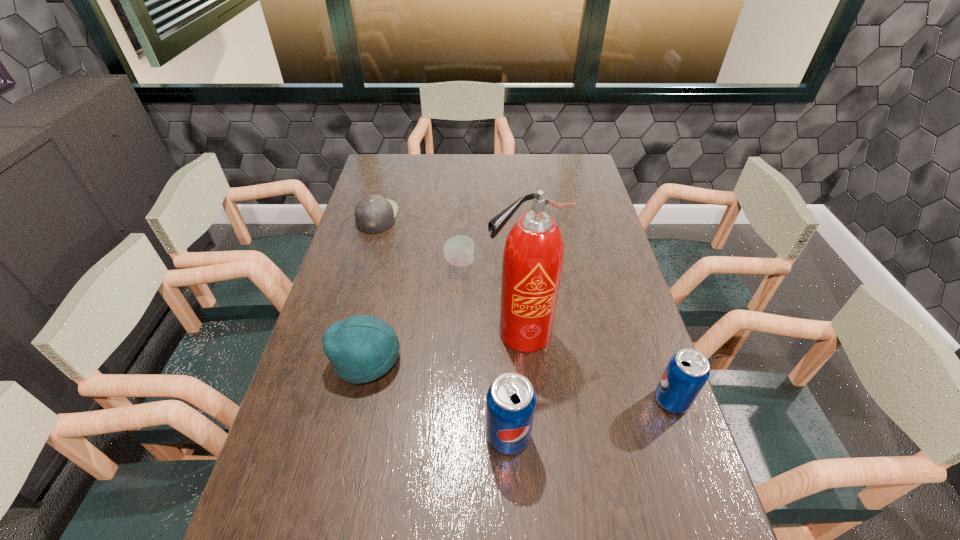
Where is `the taller pop soda`? Image resolution: width=960 pixels, height=540 pixels. the taller pop soda is located at coordinates (511, 399).

You are a GUI agent. You are given a task and a screenshot of the screen. Output one action in this format:
    pyautogui.click(x=<x>, y=<y>)
    Task: Click on the second tallest object
    
    Given the screenshot: What is the action you would take?
    pyautogui.click(x=511, y=399)

Locate an element on the screen. the right pop soda is located at coordinates (688, 370).

This screenshot has width=960, height=540. In order to click on the rightmost object in this screenshot , I will do `click(688, 370)`.

Find the location of a particular element. The height and width of the screenshot is (540, 960). the farthest object is located at coordinates (373, 214).

This screenshot has width=960, height=540. Find the location of `the third object from left to right`. the third object from left to right is located at coordinates (459, 250).

The image size is (960, 540). What are the coordinates of `the second farthest object` in the screenshot? It's located at (459, 250).

I want to click on the fourth tallest object, so click(x=361, y=348).

The width and height of the screenshot is (960, 540). In order to click on the tallest object in this screenshot , I will do `click(533, 256)`.

The image size is (960, 540). I want to click on vacant space positioned 0.280m on the left of the fifth shortest object, so click(x=365, y=436).